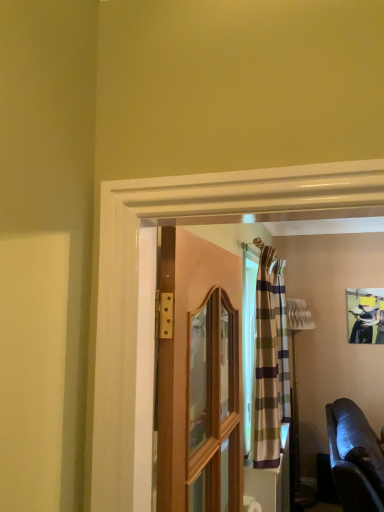
Question: Looking at the image, does striped fabric curtain at center seem bigger or smaller compared to wooden door at center?

Choices:
 (A) small
 (B) big

Answer: (B)

Question: Is striped fabric curtain at center spatially inside wooden door at center, or outside of it?

Choices:
 (A) outside
 (B) inside

Answer: (A)

Question: Which of these objects is positioned farthest from the leather couch at lower right?

Choices:
 (A) matte black picture frame at upper right
 (B) wooden door at center
 (C) striped fabric curtain at center

Answer: (B)

Question: Which object is positioned closest to the wooden door at center?

Choices:
 (A) striped fabric curtain at center
 (B) leather couch at lower right
 (C) matte black picture frame at upper right

Answer: (A)